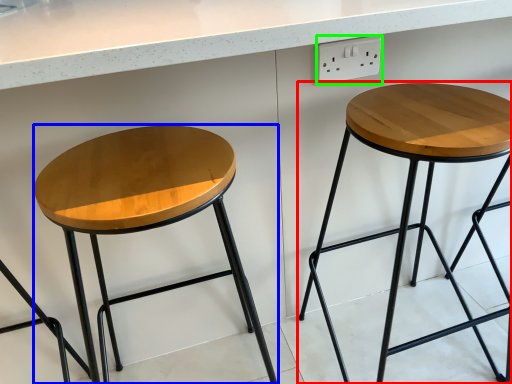
Question: Considering the real-world distances, which object is closest to stool (highlighted by a red box)? stool (highlighted by a blue box) or electric outlet (highlighted by a green box).

Choices:
 (A) stool
 (B) electric outlet

Answer: (B)